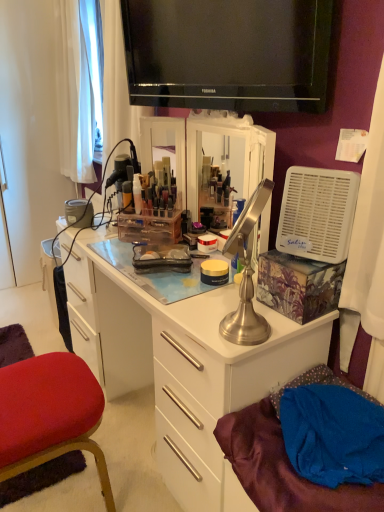
You are a GUI agent. You are given a task and a screenshot of the screen. Output one action in this format:
    pyautogui.click(x=<x>, y=<y>)
    Task: Click on the vacant space situated on the left part of satin silver lamp at center
    The width and height of the screenshot is (384, 512).
    Given the screenshot: What is the action you would take?
    pyautogui.click(x=194, y=324)